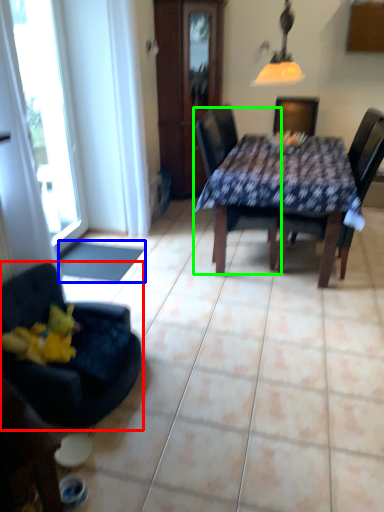
Question: Estimate the real-world distances between objects in this image. Which object is farther from chair (highlighted by a red box), flat (highlighted by a blue box) or chair (highlighted by a green box)?

Choices:
 (A) flat
 (B) chair

Answer: (B)